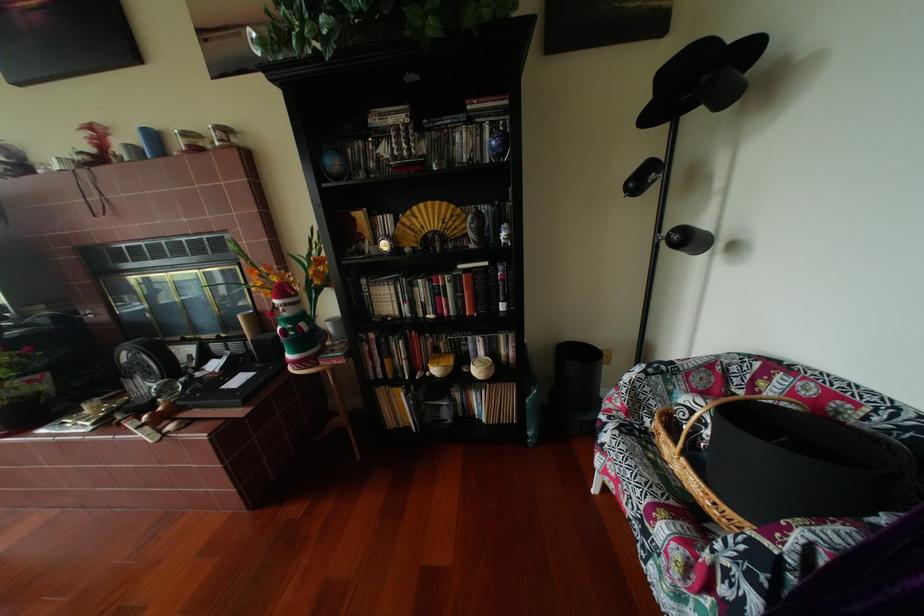
This screenshot has height=616, width=924. Describe the element at coordinates (701, 459) in the screenshot. I see `a wicker basket handle` at that location.